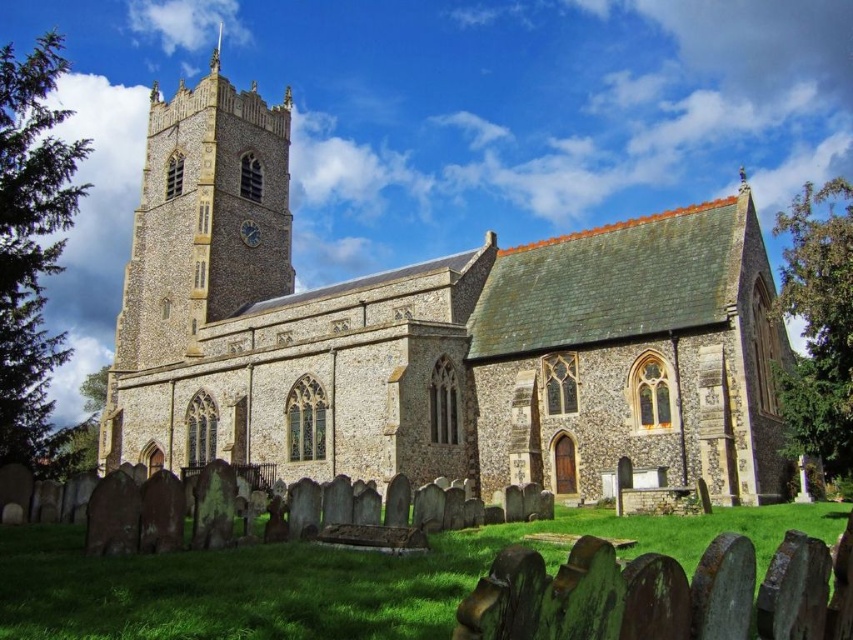
Question: Which of these objects is positioned closest to the metallic clock face at upper center?

Choices:
 (A) stone church at center
 (B) smooth silver spire at upper center

Answer: (A)

Question: Can you confirm if stone church at center is bigger than metallic clock face at upper center?

Choices:
 (A) no
 (B) yes

Answer: (B)

Question: Is brown stone clock tower at upper left positioned before metallic clock face at upper center?

Choices:
 (A) no
 (B) yes

Answer: (B)

Question: Estimate the real-world distances between objects in this image. Which object is farther from the metallic clock face at upper center?

Choices:
 (A) brown stone clock tower at upper left
 (B) stone church at center

Answer: (B)

Question: Does stone church at center appear under smooth silver spire at upper center?

Choices:
 (A) no
 (B) yes

Answer: (B)

Question: Which of the following is the farthest from the observer?

Choices:
 (A) (355, 413)
 (B) (248, 227)

Answer: (B)